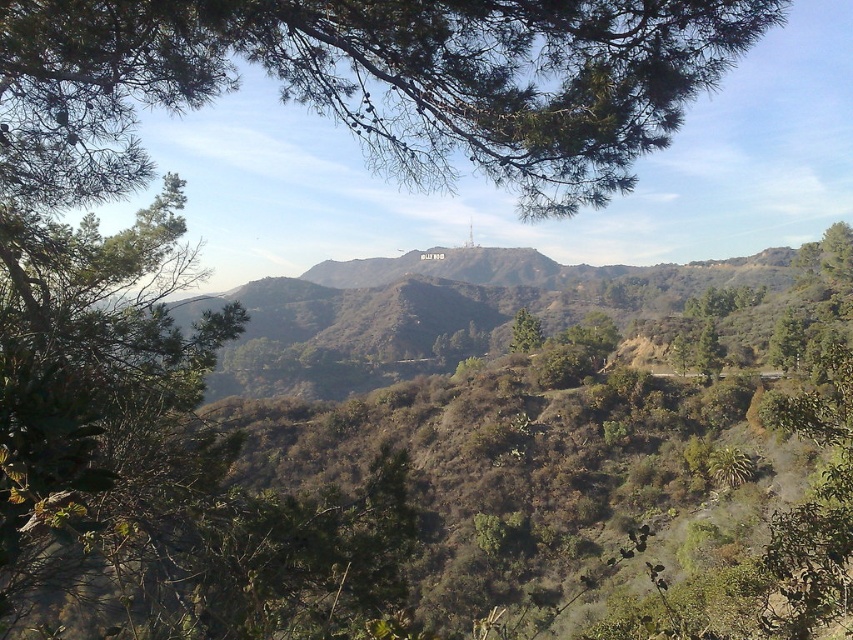
Can you confirm if green needle-like branches at upper left is positioned to the left of green leafy tree at center?

Correct, you'll find green needle-like branches at upper left to the left of green leafy tree at center.

Where is `green needle-like branches at upper left`? green needle-like branches at upper left is located at coordinates (372, 83).

Image resolution: width=853 pixels, height=640 pixels. What do you see at coordinates (372, 83) in the screenshot?
I see `green needle-like branches at upper left` at bounding box center [372, 83].

The image size is (853, 640). Identify the location of green needle-like branches at upper left. [372, 83].